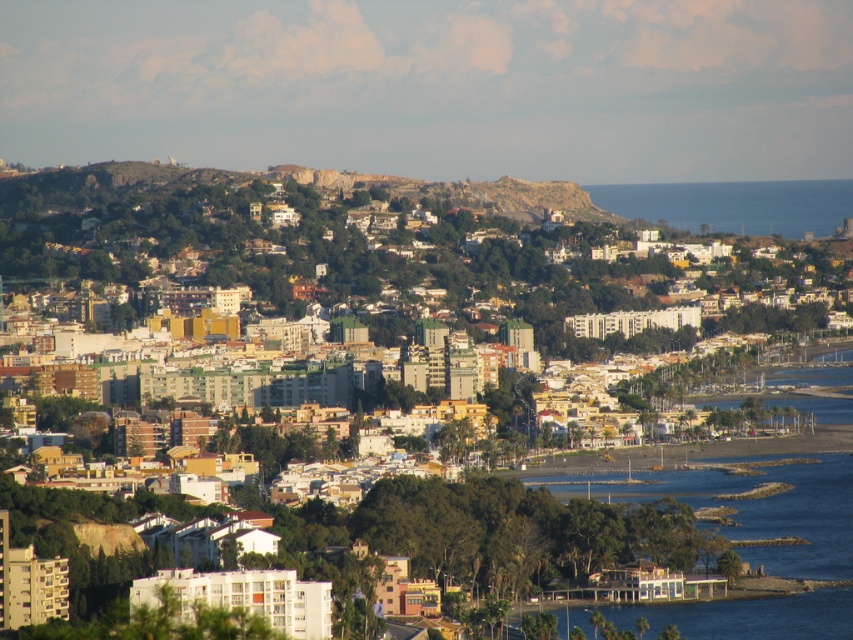
You are a drone operator trying to capture a photo of the blue water at lower right. To avoid obstruction, you need to fly your drone above the multicolored buildings at center. Is this possible?

The multicolored buildings at center are above the blue water at lower right, so flying the drone above the multicolored buildings at center would allow it to reach the blue water at lower right without obstruction.